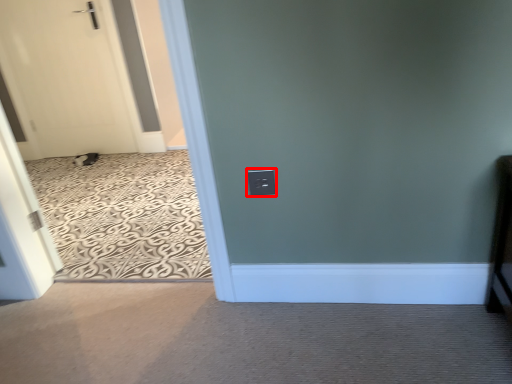
Question: From the image's perspective, considering the relative positions of electric outlet (annotated by the red box) and door in the image provided, where is electric outlet (annotated by the red box) located with respect to the staircase?

Choices:
 (A) below
 (B) above

Answer: (A)